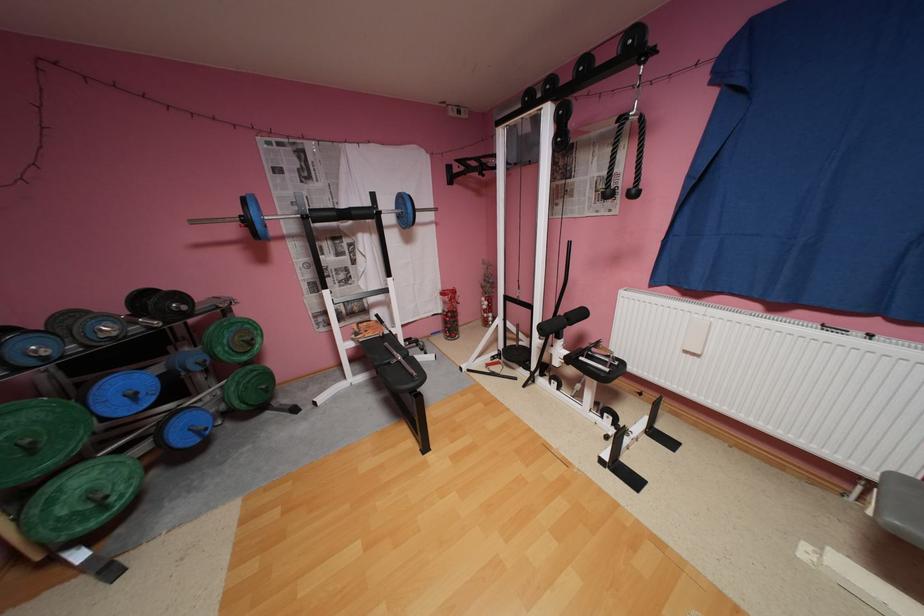
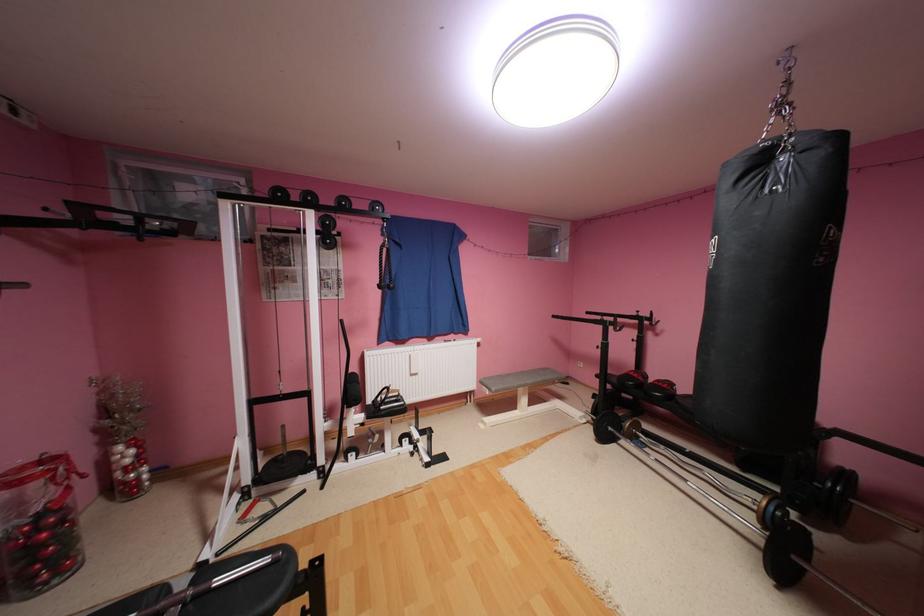
Find the pixel in the second image that matches (x=419, y=371) in the first image.

(276, 560)